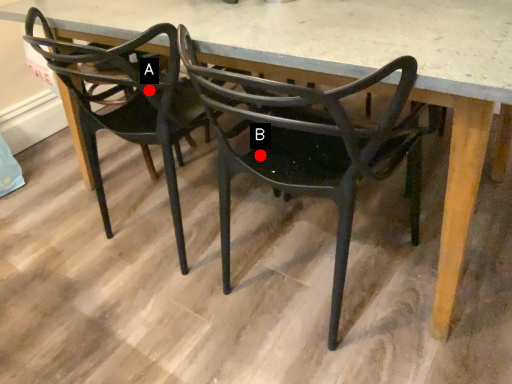
Question: Two points are circled on the image, labeled by A and B beside each circle. Among these points, which one is farthest from the camera?

Choices:
 (A) A is further
 (B) B is further

Answer: (B)